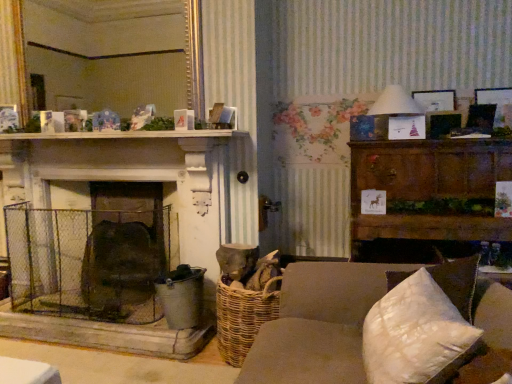
Question: Considering their positions, is wooden picture frame at upper right located in front of or behind white quilted pillow at lower right?

Choices:
 (A) front
 (B) behind

Answer: (B)

Question: From a real-world perspective, relative to white quilted pillow at lower right, is wooden picture frame at upper right vertically above or below?

Choices:
 (A) below
 (B) above

Answer: (B)

Question: Which is nearer to the dark brown wood cabinet at right?

Choices:
 (A) wooden picture frame at upper right
 (B) gold-framed mirror at upper center
 (C) rusty wire mesh fireplace screen at center-left
 (D) white paper lampshade at upper right
 (E) brown fabric couch at center

Answer: (D)

Question: Based on their relative distances, which object is farther from the wooden picture frame at upper right?

Choices:
 (A) white paper lampshade at upper right
 (B) white wooden mantle at upper center
 (C) rusty wire mesh fireplace screen at center-left
 (D) brown fabric couch at center
 (E) white quilted pillow at lower right

Answer: (C)